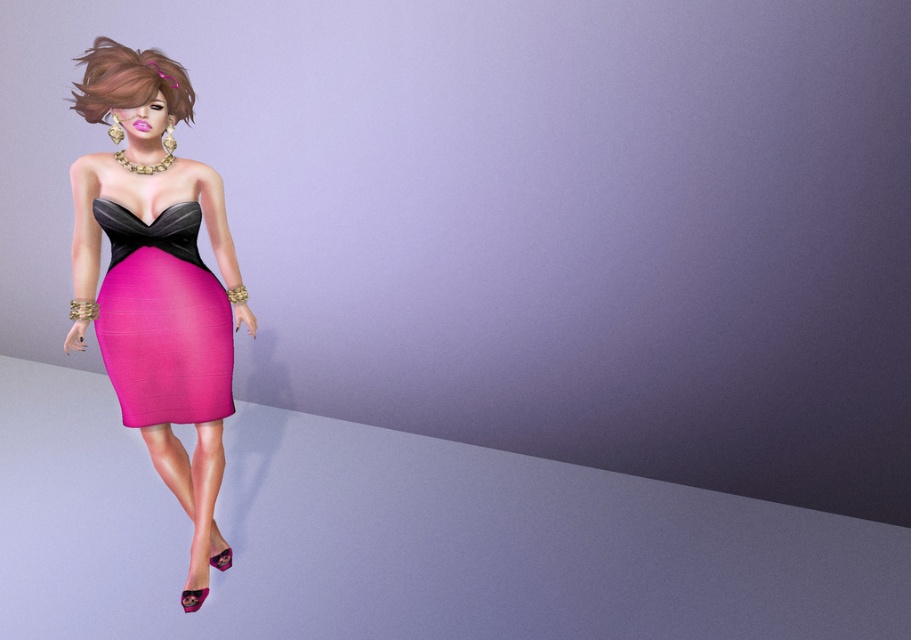
Does matte pink dress at left appear on the left side of brown shiny hair at upper left?

In fact, matte pink dress at left is to the right of brown shiny hair at upper left.

Describe the element at coordinates (157, 282) in the screenshot. I see `matte pink dress at left` at that location.

Locate an element on the screen. The width and height of the screenshot is (911, 640). matte pink dress at left is located at coordinates (157, 282).

Between matte pink dress at left and matte pink fabric dress at left, which one is positioned lower?

Positioned lower is matte pink dress at left.

Which is in front, point (89, 74) or point (136, 401)?

Point (89, 74)

Locate an element on the screen. The width and height of the screenshot is (911, 640). matte pink dress at left is located at coordinates (157, 282).

Is matte pink fabric dress at left above brown shiny hair at upper left?

No, matte pink fabric dress at left is not above brown shiny hair at upper left.

Which is below, matte pink fabric dress at left or brown shiny hair at upper left?

matte pink fabric dress at left is below.

You are a GUI agent. You are given a task and a screenshot of the screen. Output one action in this format:
    pyautogui.click(x=<x>, y=<y>)
    Task: Click on the matte pink fabric dress at left
    
    Given the screenshot: What is the action you would take?
    pyautogui.click(x=162, y=320)